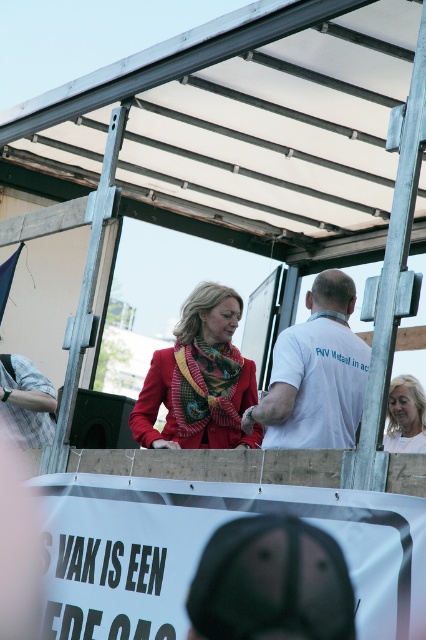
Question: Among these objects, which one is nearest to the camera?

Choices:
 (A) matte gold necklace at upper right
 (B) metallic silver canopy at upper center
 (C) white cotton t-shirt at center

Answer: (C)

Question: Does matte red coat at center have a lesser width compared to matte gold necklace at upper right?

Choices:
 (A) no
 (B) yes

Answer: (A)

Question: Which point is closer to the camera?

Choices:
 (A) white cotton t-shirt at center
 (B) metallic silver canopy at upper center
 (C) matte gold necklace at upper right

Answer: (A)

Question: Does metallic silver canopy at upper center appear under multicolored patterned scarf at center?

Choices:
 (A) no
 (B) yes

Answer: (A)

Question: Is matte red coat at center positioned behind white cotton t-shirt at center?

Choices:
 (A) no
 (B) yes

Answer: (B)

Question: Which point is farther to the camera?

Choices:
 (A) white cotton t-shirt at center
 (B) multicolored patterned scarf at center
 (C) matte red coat at center

Answer: (B)